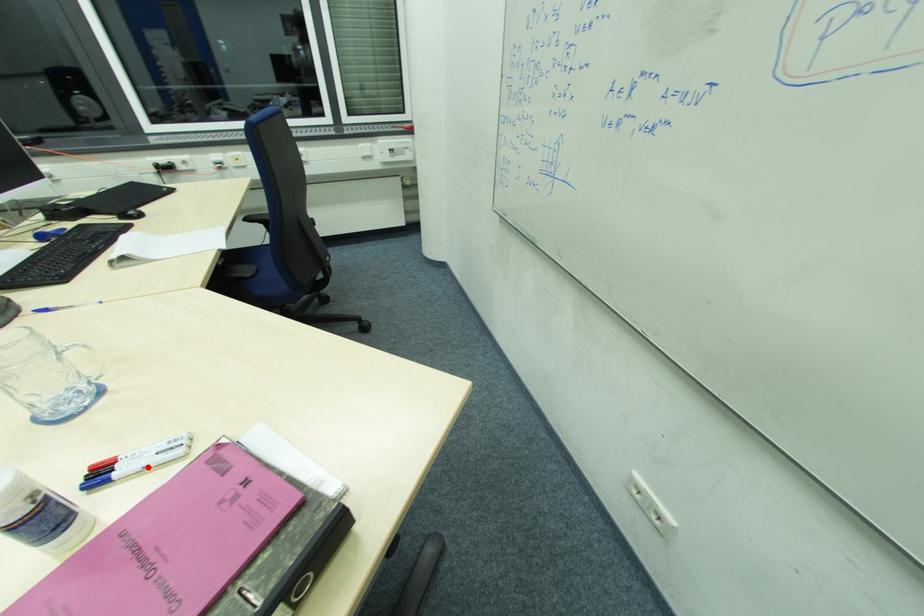
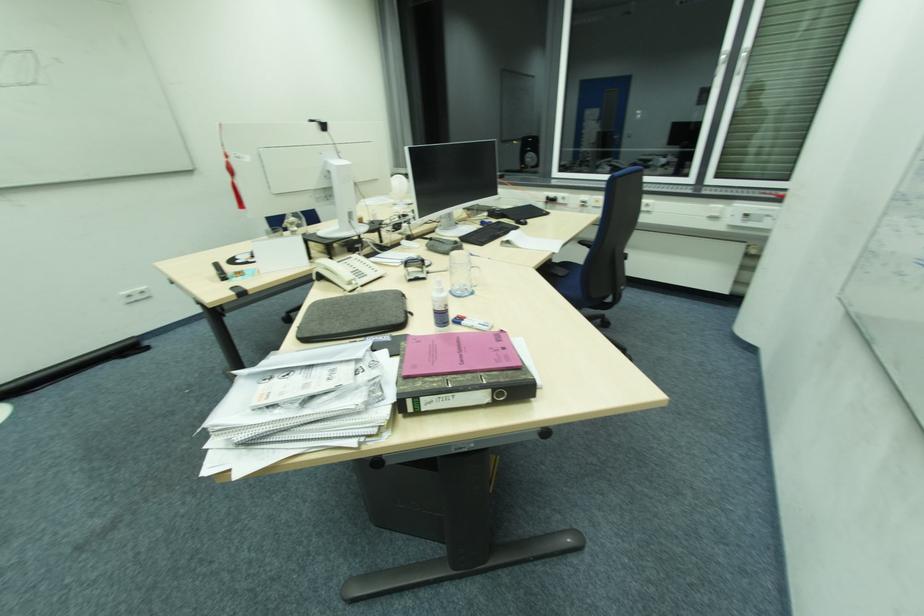
Where in the second image is the point corresponding to the highlighted location from the first image?

(477, 326)